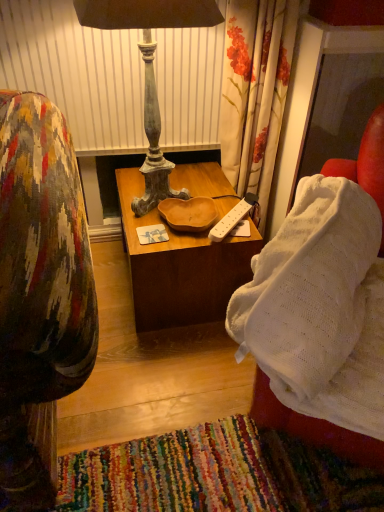
You are a GUI agent. You are given a task and a screenshot of the screen. Output one action in this format:
    pyautogui.click(x=<x>, y=<y>)
    Task: Click on the free space in front of wooden table at center
    The image size is (384, 512).
    Given the screenshot: What is the action you would take?
    pyautogui.click(x=163, y=370)